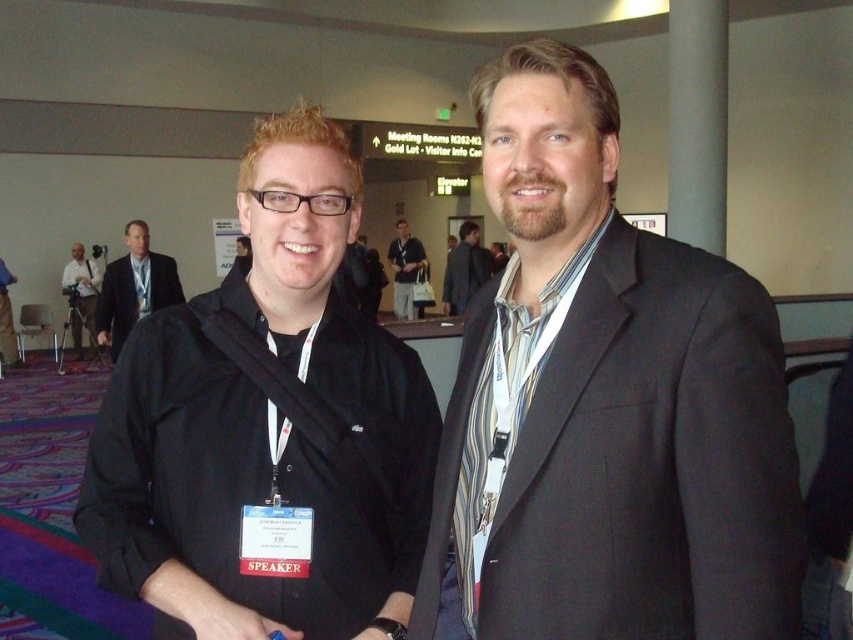
You are organizing a clothing display and need to place the dark gray suit at center and the matte black jacket at center on a mannequin. Which item will require a larger mannequin?

The dark gray suit at center requires a larger mannequin because it has a larger size compared to the matte black jacket at center.

You are a photographer at the event and need to adjust the camera height to frame both the dark gray suit at center and the matte black camera at left properly. Which object should you lower the camera to focus on?

The dark gray suit at center is shorter than the matte black camera at left, so you should lower the camera to focus on the dark gray suit at center to ensure it is properly framed.

You are an event photographer who needs to capture a photo of the dark gray suit at center without the matte black camera at left appearing in the frame. Based on their positions, can you position yourself so that the camera won

The dark gray suit at center is above the matte black camera at left, so positioning yourself below the dark gray suit at center would allow you to capture the suit without the camera in the frame.